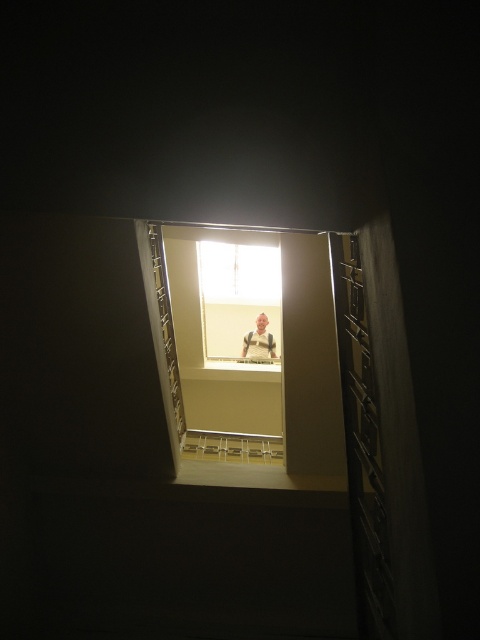
You are standing at the bottom of the white plastic stair at center and want to reach the smooth beige shirt at center. Considering their sizes, which object would require more space to move around?

The smooth beige shirt at center requires more space to move around since it is larger than the white plastic stair at center according to the description.

You are standing at the bottom of the stairs and want to hand a small gift to the person wearing the smooth beige shirt at center. The gift is 1 meter long. Can you reach them by extending your arm upwards without climbing the white plastic stair at center?

The white plastic stair at center is 3.04 meters away from the smooth beige shirt at center. Since the gift is only 1 meter long, you cannot reach the person because the distance is greater than the gift length.

Looking at this image, you are standing at the bottom of the stairs and want to reach the clear glass window at center. Can you climb the white plastic stair at center to reach it?

The clear glass window at center is larger in size than white plastic stair at center, so the white plastic stair at center may not be tall enough to reach the clear glass window at center. You might need a taller ladder or another method to reach it.